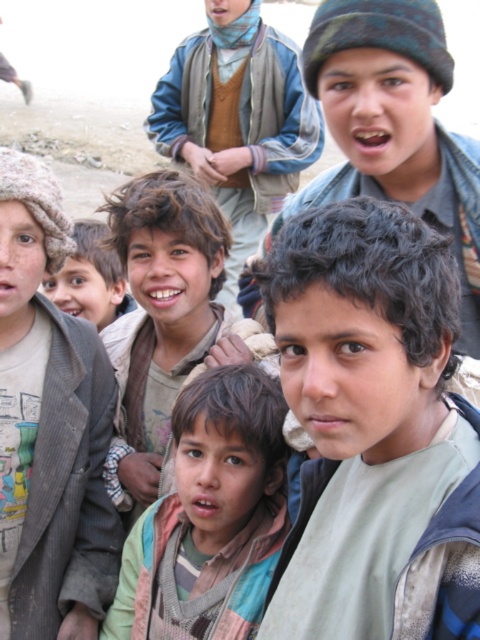
You are a photographer trying to capture a closeup of the two points in the image. Which point, point (78, 372) or point (227, 579), is closer to the camera?

Point (78, 372) is further to the camera than point (227, 579), so the closer point to the camera is point (227, 579).

You are a photographer trying to capture a photo of the children. You notice two points marked in the image. The first point is at coordinate point [387,500] and the second is at point [187,388]. Which point is closer to the camera based on their positions?

Point [387,500] is in front of point [187,388], so it is closer to the camera.

You are a photographer trying to capture a clear photo of the multicolored fabric shirt at center without the light brown woolen hat at left blocking it. Based on their sizes, can you suggest a way to frame the shot so the hat doesn t cover the shirt?

The light brown woolen hat at left is bigger than the multicolored fabric shirt at center. To avoid the hat blocking the shirt, you should position the camera so that the hat is either moved further away or the shirt is framed in a way that its smaller size allows it to be seen clearly without overlapping with the larger hat.